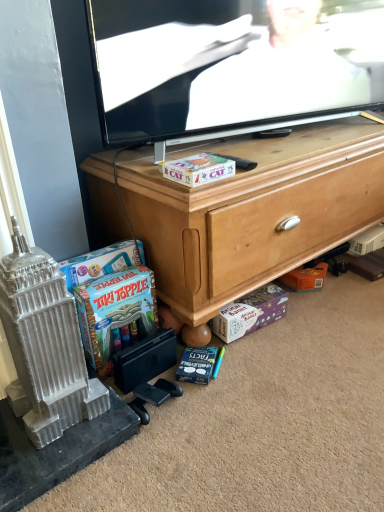
The image size is (384, 512). What are the coordinates of `vacant area that lies to the right of black plastic remote control at center` in the screenshot? It's located at (283, 159).